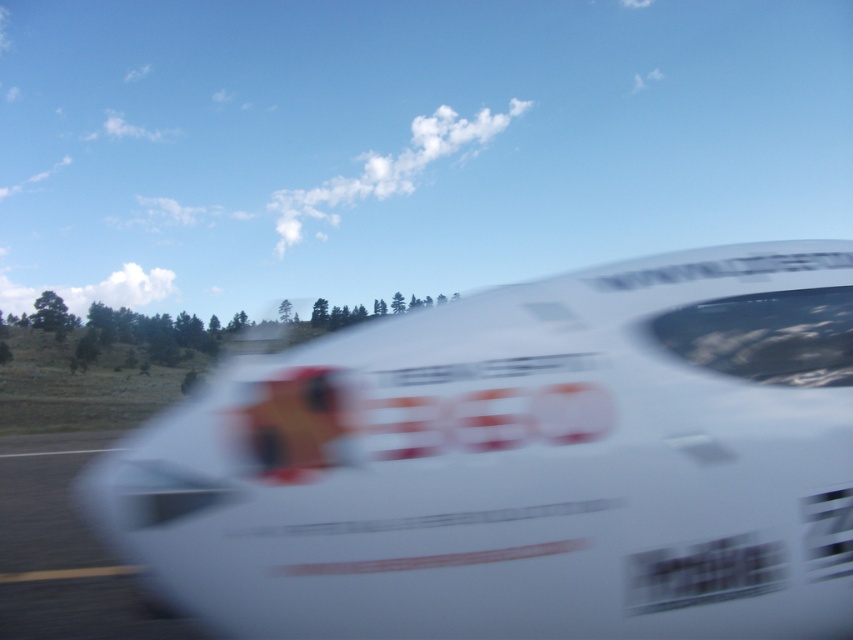
Question: Is white glossy airplane at center in front of white glossy race track at lower left?

Choices:
 (A) no
 (B) yes

Answer: (B)

Question: Which object is closer to the camera taking this photo?

Choices:
 (A) white glossy race track at lower left
 (B) white glossy airplane at center

Answer: (B)

Question: Does white glossy airplane at center have a larger size compared to white glossy race track at lower left?

Choices:
 (A) yes
 (B) no

Answer: (A)

Question: Which point is farther to the camera?

Choices:
 (A) (265, 516)
 (B) (51, 616)

Answer: (B)

Question: Can you confirm if white glossy airplane at center is bigger than white glossy race track at lower left?

Choices:
 (A) no
 (B) yes

Answer: (B)